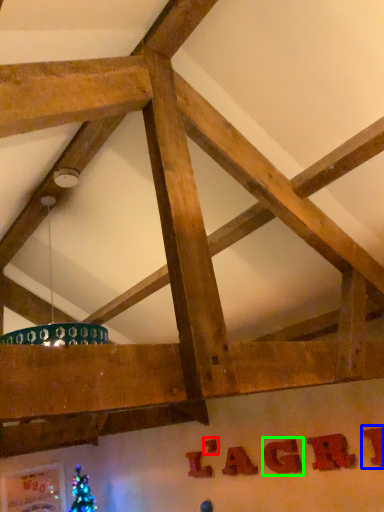
Question: Which object is positioned closest to letter (highlighted by a red box)? Select from letter (highlighted by a blue box) and letter (highlighted by a green box).

Choices:
 (A) letter
 (B) letter

Answer: (B)